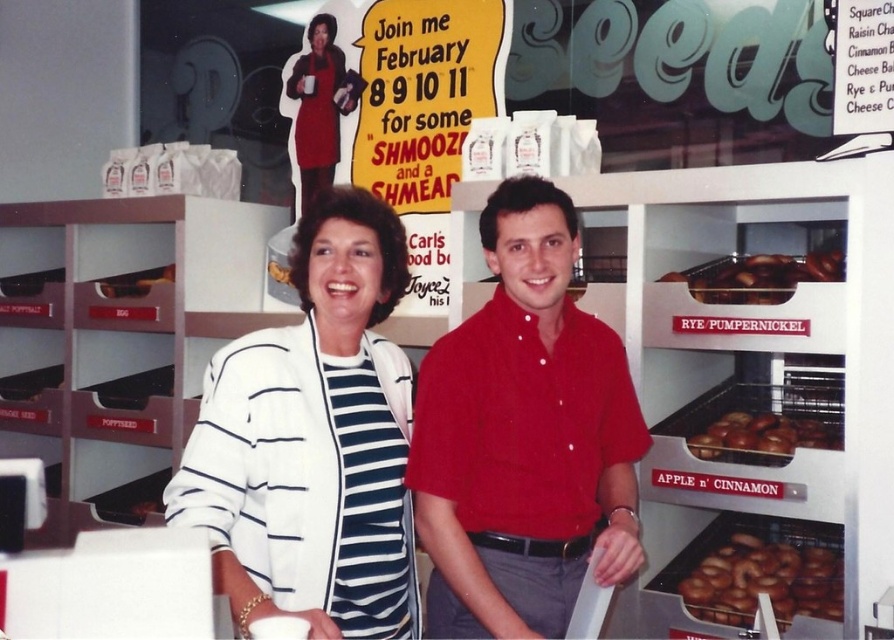
You are a customer in the bakery and want to choose between the golden brown bagel at right and the brown matte bagels at center right. Which option takes up more space on the shelf?

The brown matte bagels at center right take up more space than the golden brown bagel at right.

You are a customer in a bakery and want to grab both the white striped blazer at center and the golden brown bagel at right. However, you can only reach one at a time. Which one should you reach for first if you want to minimize the distance you have to move?

Since the white striped blazer at center is positioned on the left side of the golden brown bagel at right, you should reach for the white striped blazer at center first as it is closer to your current position.

You are a photographer setting up for an event. You need to ensure that both the red cotton shirt at center and the white striped blazer at center are visible in the photo. Based on their positions, which one is lower in the frame?

The red cotton shirt at center is positioned under the white striped blazer at center, so it is lower in the frame.